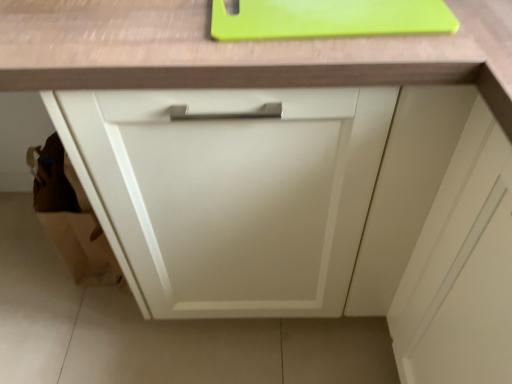
Question: From a real-world perspective, is matte white cabinet at center located higher than green plastic cutting board at upper center?

Choices:
 (A) yes
 (B) no

Answer: (B)

Question: Can you confirm if matte white cabinet at center is bigger than green plastic cutting board at upper center?

Choices:
 (A) yes
 (B) no

Answer: (A)

Question: Is matte white cabinet at center outside of green plastic cutting board at upper center?

Choices:
 (A) no
 (B) yes

Answer: (B)

Question: Does matte white cabinet at center lie in front of green plastic cutting board at upper center?

Choices:
 (A) no
 (B) yes

Answer: (B)

Question: Considering the relative sizes of matte white cabinet at center and green plastic cutting board at upper center in the image provided, is matte white cabinet at center shorter than green plastic cutting board at upper center?

Choices:
 (A) yes
 (B) no

Answer: (B)

Question: Is matte white cabinet at center at the right side of green plastic cutting board at upper center?

Choices:
 (A) yes
 (B) no

Answer: (B)

Question: Does green plastic cutting board at upper center have a lesser height compared to matte white cabinet at center?

Choices:
 (A) yes
 (B) no

Answer: (A)

Question: From a real-world perspective, is green plastic cutting board at upper center physically below matte white cabinet at center?

Choices:
 (A) no
 (B) yes

Answer: (A)

Question: Are green plastic cutting board at upper center and matte white cabinet at center far apart?

Choices:
 (A) no
 (B) yes

Answer: (A)

Question: Is green plastic cutting board at upper center completely or partially outside of matte white cabinet at center?

Choices:
 (A) no
 (B) yes

Answer: (A)

Question: From the image's perspective, is green plastic cutting board at upper center located above matte white cabinet at center?

Choices:
 (A) yes
 (B) no

Answer: (A)

Question: Is green plastic cutting board at upper center at the right side of matte white cabinet at center?

Choices:
 (A) yes
 (B) no

Answer: (A)

Question: From a real-world perspective, is green plastic cutting board at upper center physically located above or below matte white cabinet at center?

Choices:
 (A) below
 (B) above

Answer: (B)